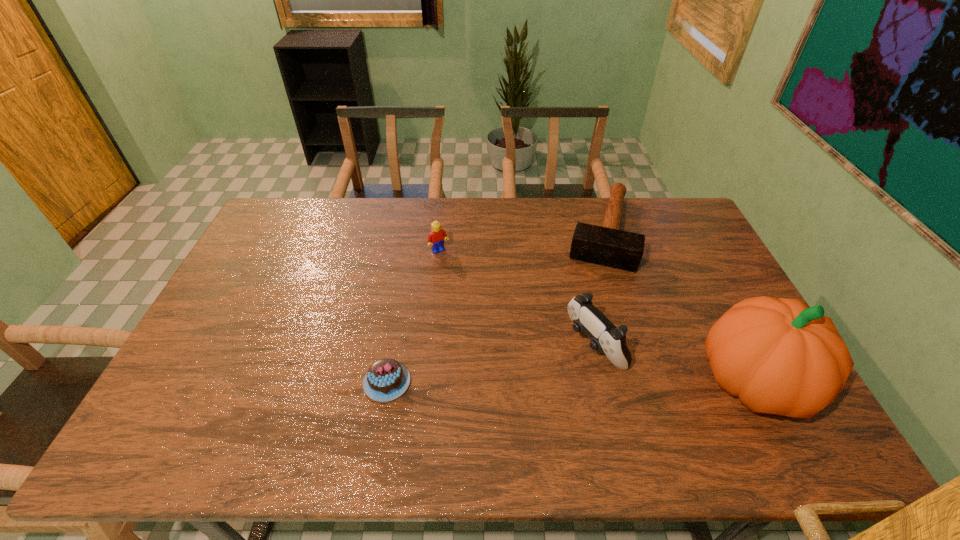
Where is `free region located on the striking face of the second shortest object`? free region located on the striking face of the second shortest object is located at coordinates (581, 355).

This screenshot has height=540, width=960. I want to click on free spot located on the striking face of the second shortest object, so click(x=592, y=303).

You are a GUI agent. You are given a task and a screenshot of the screen. Output one action in this format:
    pyautogui.click(x=<x>, y=<y>)
    Task: Click on the vacant region located on the front-facing side of the second object from left to right
    The width and height of the screenshot is (960, 540).
    Given the screenshot: What is the action you would take?
    pyautogui.click(x=455, y=269)

This screenshot has width=960, height=540. I want to click on free space located 0.110m on the front-facing side of the second object from left to right, so click(x=459, y=275).

At what (x,y) coordinates should I click in order to perform the action: click on free space located on the front-facing side of the second object from left to right. Please return your answer as a coordinate pair (x, y). Looking at the image, I should click on (455, 269).

At what (x,y) coordinates should I click in order to perform the action: click on vacant space located 0.230m on the front-facing side of the control. Please return your answer as a coordinate pair (x, y). Looking at the image, I should click on (499, 400).

You are a GUI agent. You are given a task and a screenshot of the screen. Output one action in this format:
    pyautogui.click(x=<x>, y=<y>)
    Task: Click on the vacant space located 0.260m on the front-facing side of the control
    The image size is (960, 540).
    Given the screenshot: What is the action you would take?
    pyautogui.click(x=490, y=405)

You are a GUI agent. You are given a task and a screenshot of the screen. Output one action in this format:
    pyautogui.click(x=<x>, y=<y>)
    Task: Click on the free location located 0.050m on the front-facing side of the control
    
    Given the screenshot: What is the action you would take?
    pyautogui.click(x=557, y=368)

What are the coordinates of `object at the far edge` in the screenshot? It's located at (606, 245).

Find the location of a particular element. chocolate cake that is at the near edge is located at coordinates (386, 379).